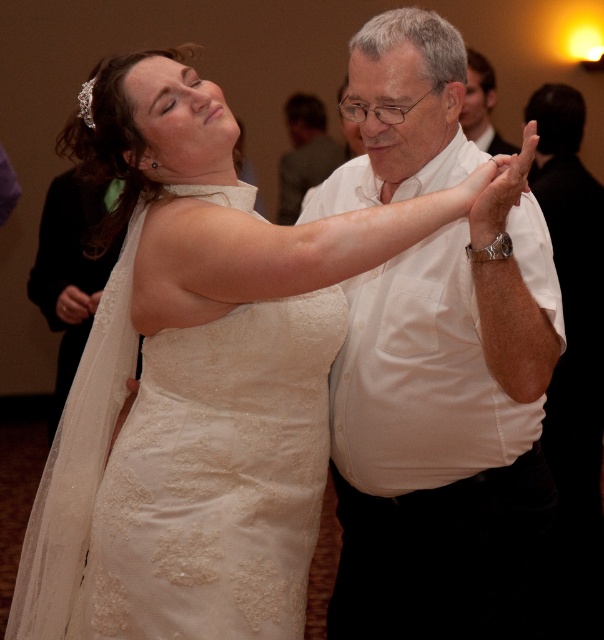
From the picture: Is white cotton shirt at center further to camera compared to lace fabric dress at center?

No, it is not.

Does white cotton shirt at center have a larger size compared to lace fabric dress at center?

Correct, white cotton shirt at center is larger in size than lace fabric dress at center.

Where is `white cotton shirt at center`? Image resolution: width=604 pixels, height=640 pixels. white cotton shirt at center is located at coordinates (448, 428).

Can you confirm if white shirt at center is positioned to the right of white shirt at upper center?

Incorrect, white shirt at center is not on the right side of white shirt at upper center.

Does white shirt at center have a smaller size compared to white shirt at upper center?

Yes, white shirt at center is smaller than white shirt at upper center.

Does point (321, 177) come farther from viewer compared to point (489, 104)?

Yes, it is.

Locate an element on the screen. The height and width of the screenshot is (640, 604). white shirt at center is located at coordinates (304, 154).

Who is positioned more to the left, lace fabric dress at center or white shirt at center?

lace fabric dress at center

Between point (230, 472) and point (307, 141), which one is positioned in front?

Point (230, 472) is in front.

The height and width of the screenshot is (640, 604). In order to click on lace fabric dress at center in this screenshot , I will do `click(184, 476)`.